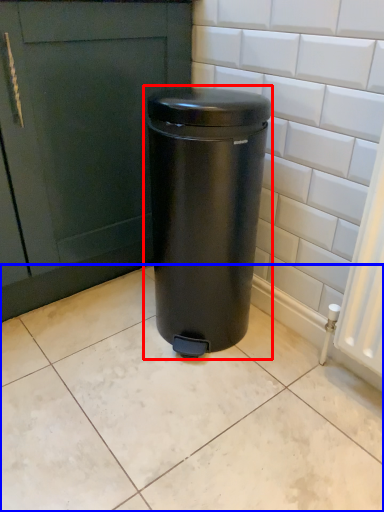
Question: Which point is closer to the camera, waste container (highlighted by a red box) or ceramic tile (highlighted by a blue box)?

Choices:
 (A) waste container
 (B) ceramic tile

Answer: (B)